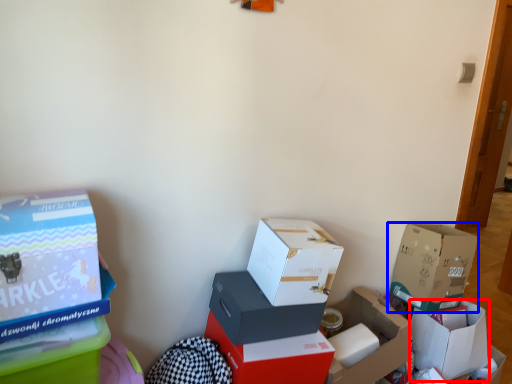
Question: Among these objects, which one is farthest to the camera, box (highlighted by a red box) or box (highlighted by a blue box)?

Choices:
 (A) box
 (B) box

Answer: (A)